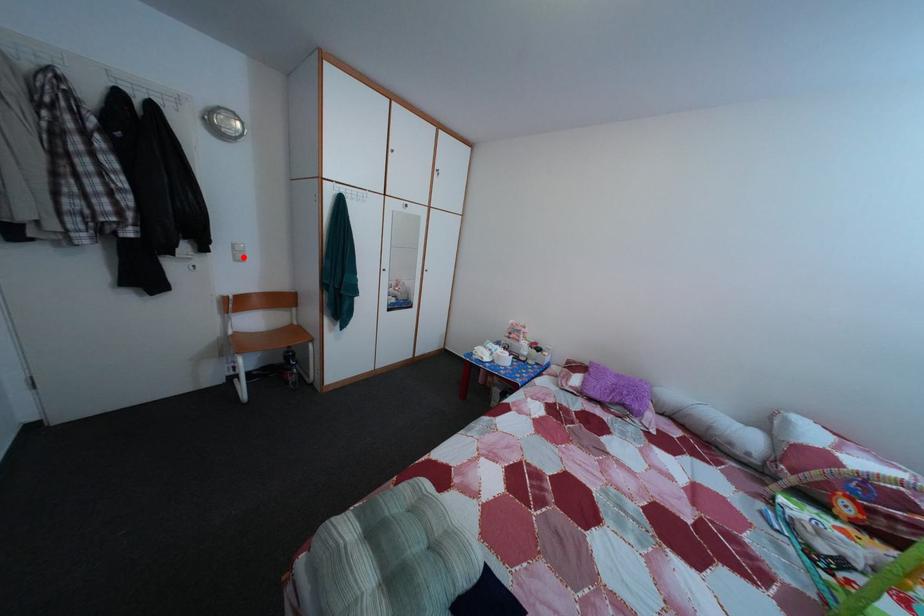
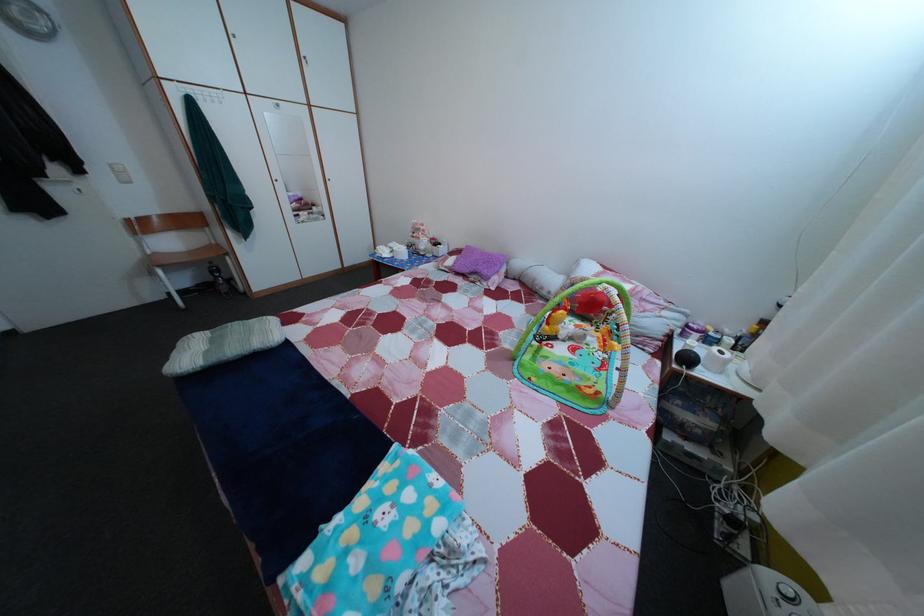
Question: I am providing you with two images of the same scene from different viewpoints. A red point is shown in image1. For the corresponding object point in image2, is it positioned nearer or farther from the camera?

Choices:
 (A) Nearer
 (B) Farther

Answer: (B)